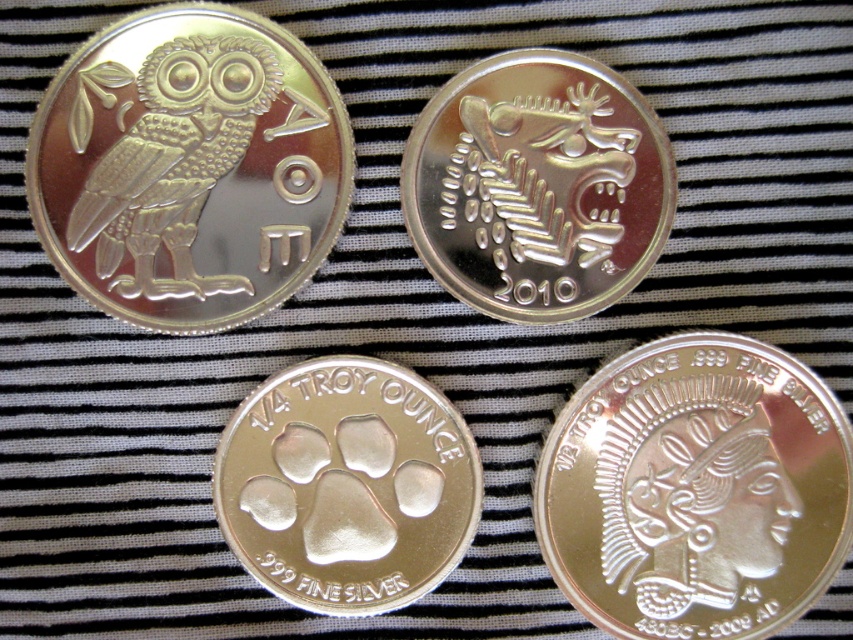
In the scene shown: You are an appraiser examining the coins. You need to determine the spatial relationship between the polished silver owl at upper left and the polished silver coin at center. Which coin is positioned to the right of the other?

The polished silver coin at center is positioned to the right of the polished silver owl at upper left. This is because the owl is to the left of the center coin, meaning the center coin is to the right of the owl.

You are a collector who wants to place a new coin between the polished silver owl at upper left and the polished silver coin at center. The new coin has a diameter of 2 inches. Can you fit it between them without overlapping?

The distance between the polished silver owl at upper left and the polished silver coin at center is 16.17 inches. Since the new coin has a diameter of 2 inches, there is sufficient space between them to fit the new coin without overlapping.